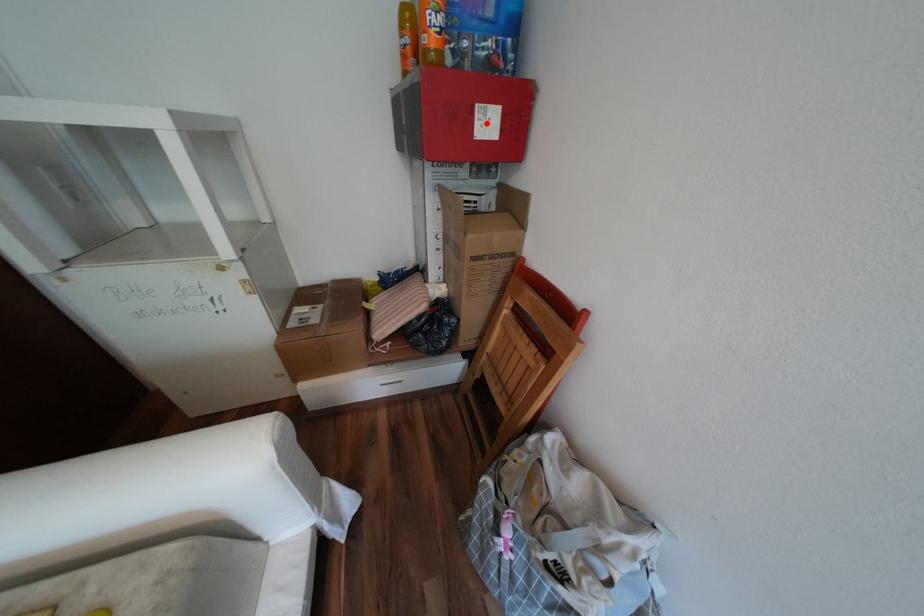
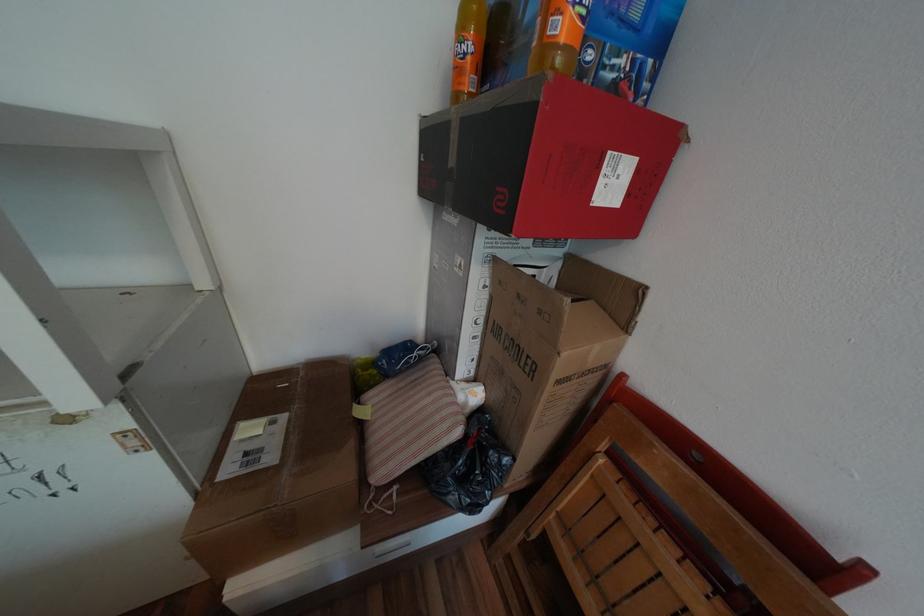
Locate, in the second image, the point that corresponds to the highlighted location in the first image.

(611, 182)